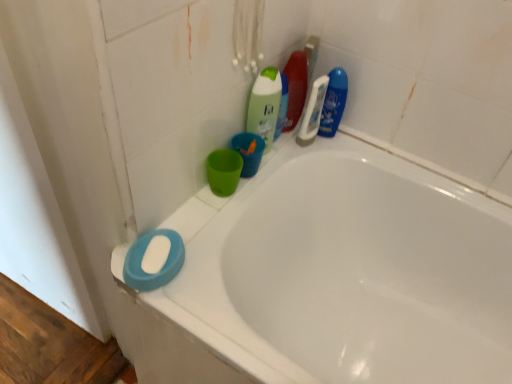
Locate an element on the screen. Image resolution: width=512 pixels, height=384 pixels. free space on the front side of matte plastic cup at upper center is located at coordinates (206, 226).